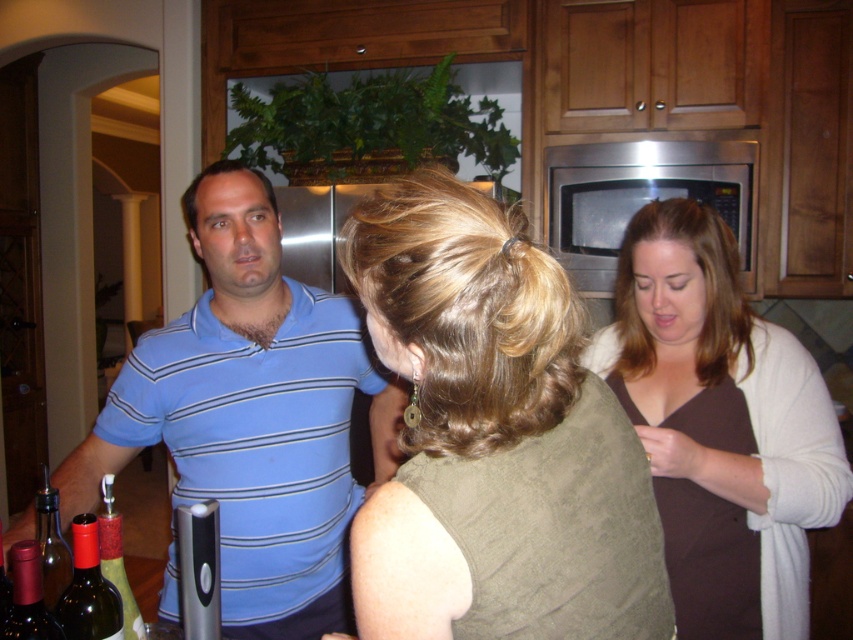
Can you confirm if blue striped polo shirt at left is positioned to the right of translucent glass bottle at lower left?

Correct, you'll find blue striped polo shirt at left to the right of translucent glass bottle at lower left.

Who is taller, blue striped polo shirt at left or translucent glass bottle at lower left?

blue striped polo shirt at left

Locate an element on the screen. The height and width of the screenshot is (640, 853). blue striped polo shirt at left is located at coordinates (252, 416).

Where is `blue striped polo shirt at left`? The height and width of the screenshot is (640, 853). blue striped polo shirt at left is located at coordinates (252, 416).

In the scene shown: Can you confirm if matte olive green blouse at center is smaller than blue striped polo shirt at left?

Yes, matte olive green blouse at center is smaller than blue striped polo shirt at left.

Measure the distance between matte olive green blouse at center and camera.

24.61 inches

I want to click on matte olive green blouse at center, so click(x=494, y=436).

Can you confirm if brown matte sweater at upper right is positioned below translucent glass bottle at lower left?

Actually, brown matte sweater at upper right is above translucent glass bottle at lower left.

Does brown matte sweater at upper right appear over translucent glass bottle at lower left?

Yes.

Who is more distant from viewer, (779,476) or (42,474)?

Positioned behind is point (779,476).

This screenshot has width=853, height=640. I want to click on brown matte sweater at upper right, so click(x=720, y=426).